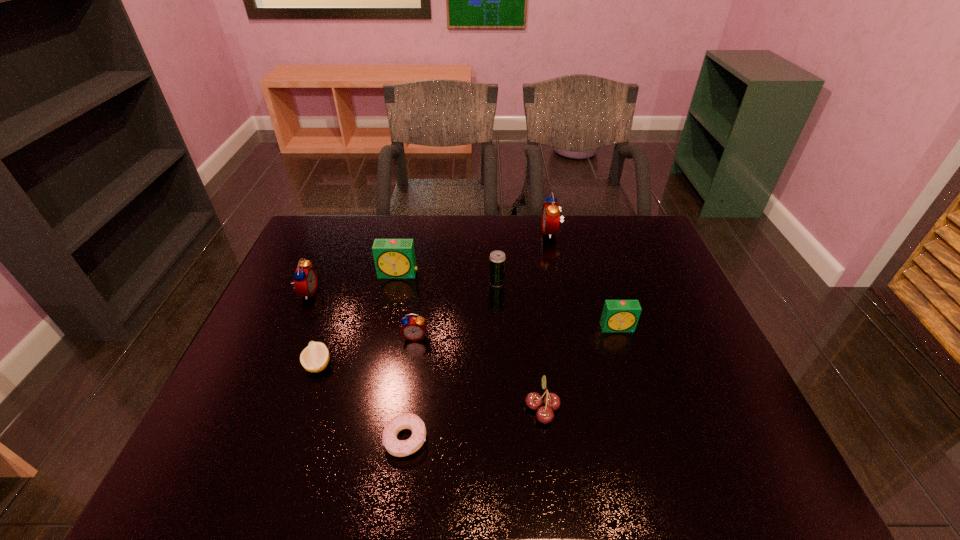
Find the location of a particular element. This screenshot has height=540, width=960. the fourth closest alarm clock to the farthest alarm clock is located at coordinates (305, 282).

Point out which red alarm clock is positioned as the third nearest to the left green alarm clock. Please provide its 2D coordinates. Your answer should be formatted as a tuple, i.e. [(x, y)], where the tuple contains the x and y coordinates of a point satisfying the conditions above.

[(551, 210)]

Locate which red alarm clock ranks second in proximity to the beer can. Please provide its 2D coordinates. Your answer should be formatted as a tuple, i.e. [(x, y)], where the tuple contains the x and y coordinates of a point satisfying the conditions above.

[(413, 328)]

Where is `free space that satisfies the following two spatial constraints: 1. on the front-facing side of the second farthest alarm clock; 2. on the right side of the beer can`? free space that satisfies the following two spatial constraints: 1. on the front-facing side of the second farthest alarm clock; 2. on the right side of the beer can is located at coordinates (396, 283).

Find the location of a particular element. vacant space that satisfies the following two spatial constraints: 1. on the front-facing side of the fourth alarm clock from left to right; 2. on the front side of the white doughnut is located at coordinates (594, 439).

At what (x,y) coordinates should I click in order to perform the action: click on free location that satisfies the following two spatial constraints: 1. on the front-facing side of the second farthest alarm clock; 2. on the front-facing side of the leftmost alarm clock. Please return your answer as a coordinate pair (x, y). Image resolution: width=960 pixels, height=540 pixels. Looking at the image, I should click on (395, 292).

Identify the location of free space that satisfies the following two spatial constraints: 1. on the front-facing side of the left green alarm clock; 2. on the front-facing side of the leftmost red alarm clock. This screenshot has width=960, height=540. (395, 292).